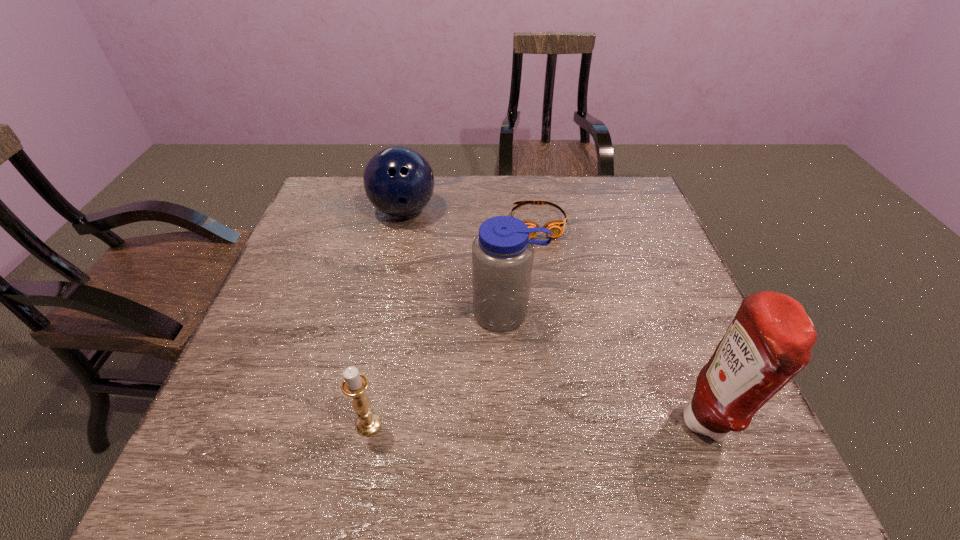
I want to click on vacant space situated with a carrying loop on the side of the water bottle, so click(x=490, y=414).

I want to click on vacant area located with a carrying loop on the side of the water bottle, so click(x=491, y=404).

At what (x,y) coordinates should I click in order to perform the action: click on vacant space located 0.050m on the surface of the bowling ball near the finger holes. Please return your answer as a coordinate pair (x, y). Looking at the image, I should click on (424, 238).

Find the location of `vacant space located 0.190m on the surface of the bowling ball near the finger holes`. vacant space located 0.190m on the surface of the bowling ball near the finger holes is located at coordinates (446, 267).

Find the location of a particular element. The image size is (960, 540). vacant space located on the surface of the bowling ball near the finger holes is located at coordinates (477, 306).

The image size is (960, 540). Identify the location of free space located 0.100m with the lenses facing forward on the shortest object. (546, 265).

Locate an element on the screen. Image resolution: width=960 pixels, height=540 pixels. vacant space situated 0.400m with the lenses facing forward on the shortest object is located at coordinates (565, 358).

Where is `free space located with the lenses facing forward on the shortest object`? The height and width of the screenshot is (540, 960). free space located with the lenses facing forward on the shortest object is located at coordinates (562, 340).

This screenshot has height=540, width=960. Find the location of `bowling ball situated at the far edge`. bowling ball situated at the far edge is located at coordinates (398, 180).

I want to click on goggles at the far edge, so click(556, 227).